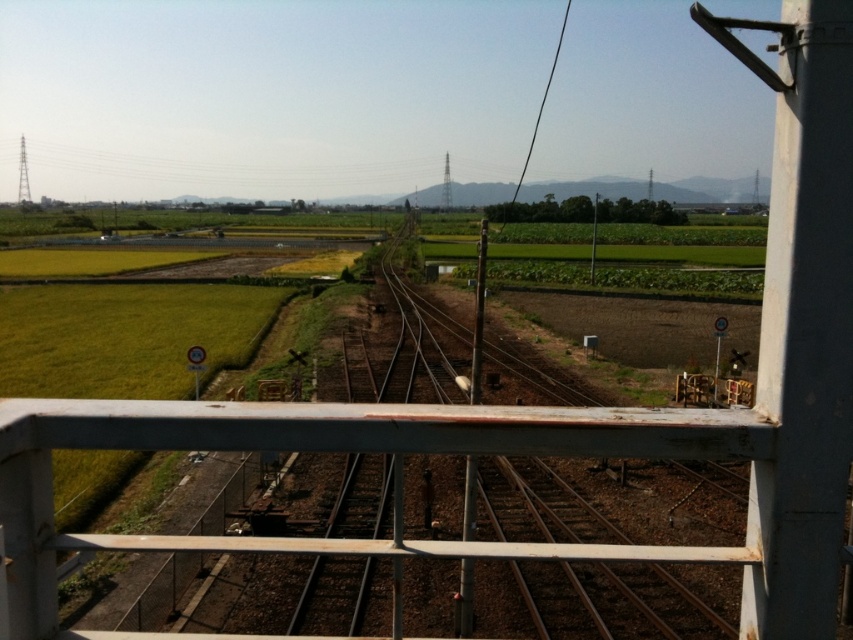
Question: Does metallic pole at center have a greater width compared to black wire at upper center?

Choices:
 (A) yes
 (B) no

Answer: (B)

Question: Among these objects, which one is nearest to the camera?

Choices:
 (A) metallic pole at center
 (B) black wire at upper center

Answer: (A)

Question: Does metallic pole at center appear on the left side of black wire at upper center?

Choices:
 (A) no
 (B) yes

Answer: (B)

Question: Does metallic pole at center have a greater width compared to black wire at upper center?

Choices:
 (A) yes
 (B) no

Answer: (B)

Question: Which object appears farthest from the camera in this image?

Choices:
 (A) metallic pole at center
 (B) black wire at upper center

Answer: (B)